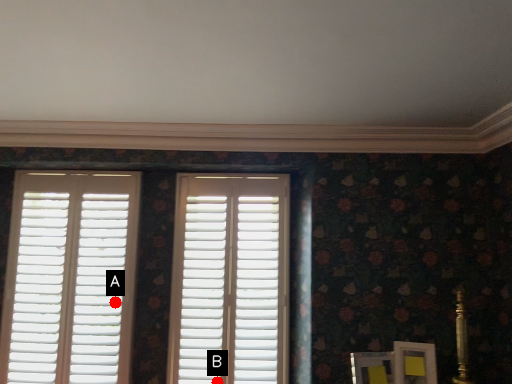
Question: Two points are circled on the image, labeled by A and B beside each circle. Which point appears farthest from the camera in this image?

Choices:
 (A) A is further
 (B) B is further

Answer: (A)